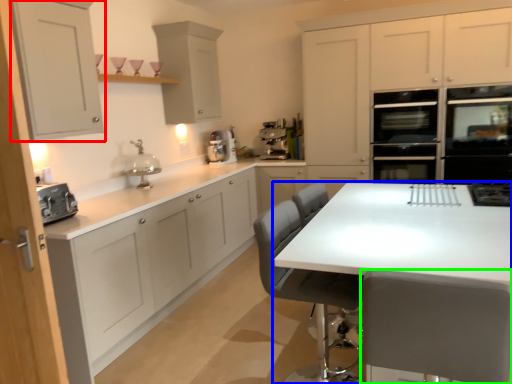
Question: Estimate the real-world distances between objects in this image. Which object is farther from cabinetry (highlighted by a red box), table (highlighted by a blue box) or chair (highlighted by a green box)?

Choices:
 (A) table
 (B) chair

Answer: (B)